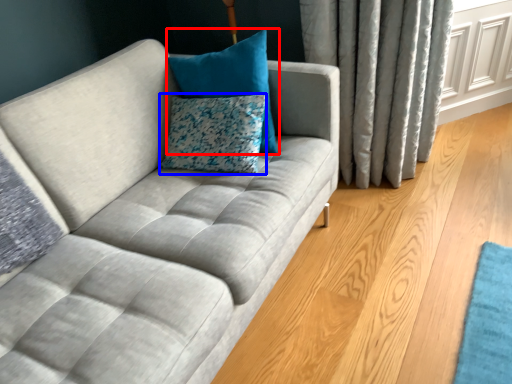
Question: Which object appears farthest to the camera in this image, pillow (highlighted by a red box) or pillow (highlighted by a blue box)?

Choices:
 (A) pillow
 (B) pillow

Answer: (B)